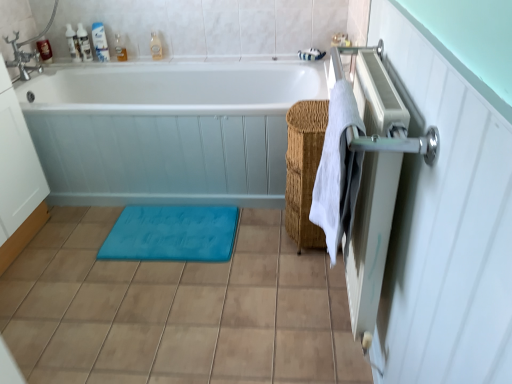
Image resolution: width=512 pixels, height=384 pixels. In order to click on vacant space situated on the left part of blue rubber bath mat at center in this screenshot , I will do `click(70, 243)`.